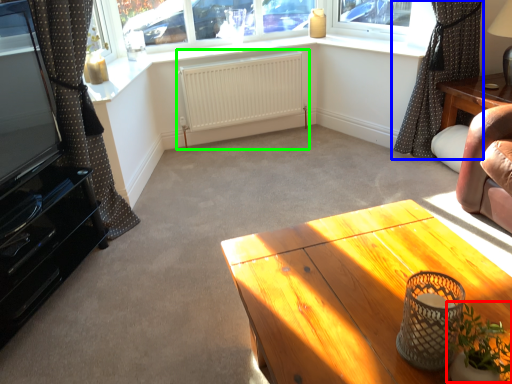
Question: Which object is the farthest from plant (highlighted by a red box)? Choose among these: curtain (highlighted by a blue box) or radiator (highlighted by a green box).

Choices:
 (A) curtain
 (B) radiator

Answer: (B)